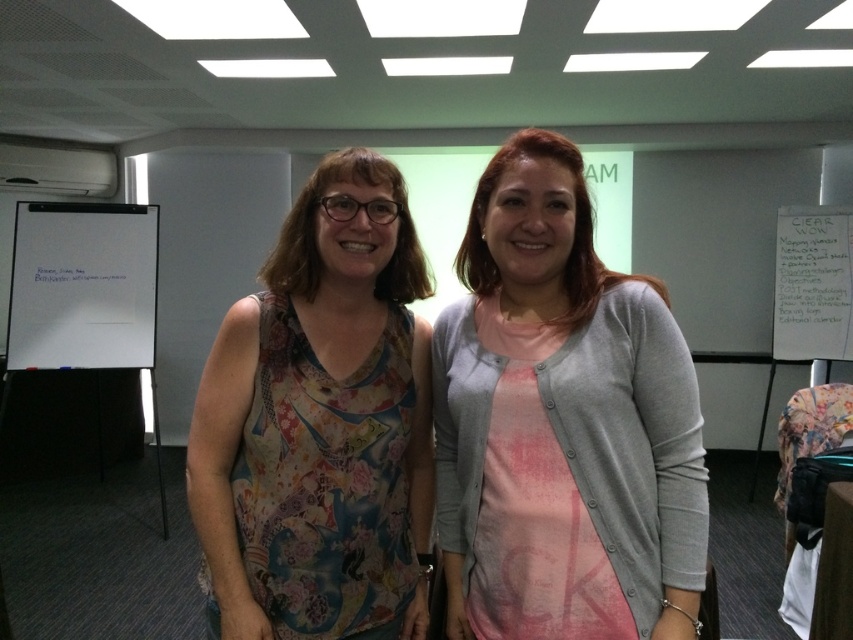
You are organizing a presentation and need to place a whiteboard and a white paper in a way that they are not overlapping. Given the current arrangement, can you move the whiteboard at left so that it is above the white paper at right?

The whiteboard at left is currently positioned under the white paper at right, so moving it above would require adjusting its placement to be higher than the current position.